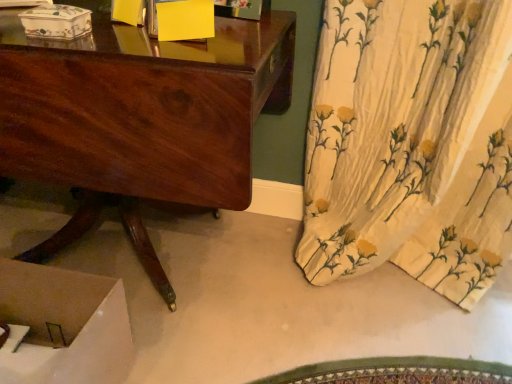
Where is `vacant point to the right of porcelain floral box at upper left, the first box positioned from the left`? This screenshot has height=384, width=512. vacant point to the right of porcelain floral box at upper left, the first box positioned from the left is located at coordinates (119, 44).